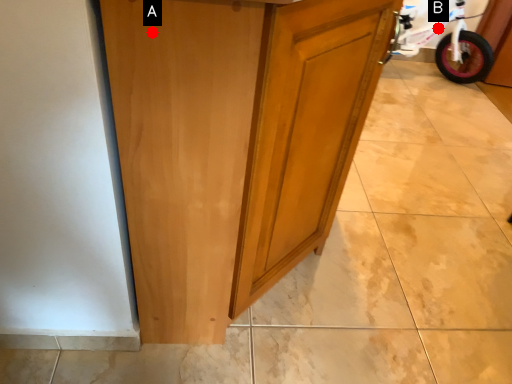
Question: Two points are circled on the image, labeled by A and B beside each circle. Which point is further to the camera?

Choices:
 (A) A is further
 (B) B is further

Answer: (B)